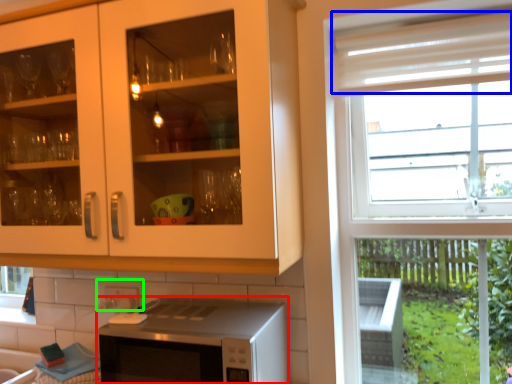
Question: Considering the real-world distances, which object is farthest from microwave oven (highlighted by a red box)? curtain (highlighted by a blue box) or tile (highlighted by a green box)?

Choices:
 (A) curtain
 (B) tile

Answer: (A)